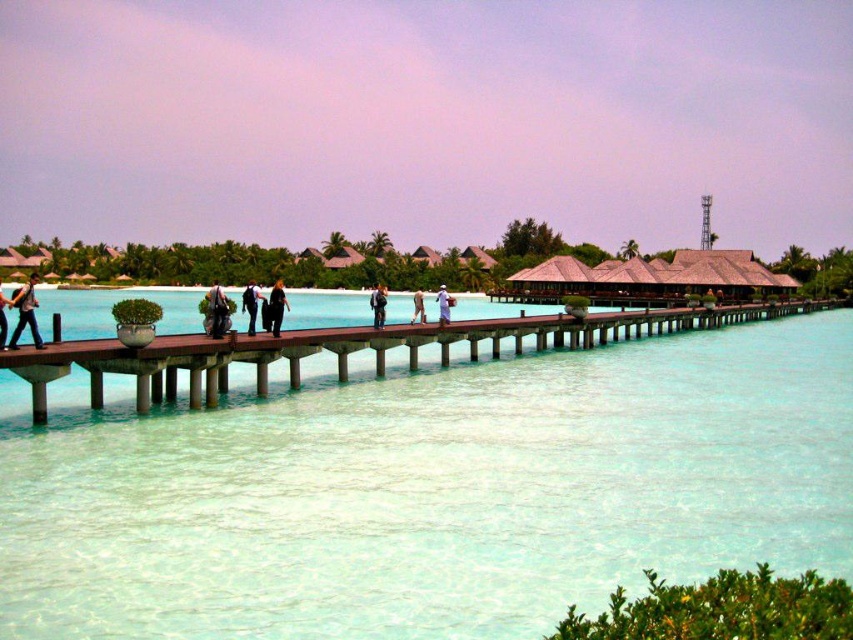
You are standing at the edge of the wooden jetty and want to reach a specific location marked by point coordinates. There are two points of interest labeled as point (120,349) and point (218,332). Which point is closer to you?

Point (120,349) is closer to the viewer than point (218,332), so the point (120,349) is closer to you.